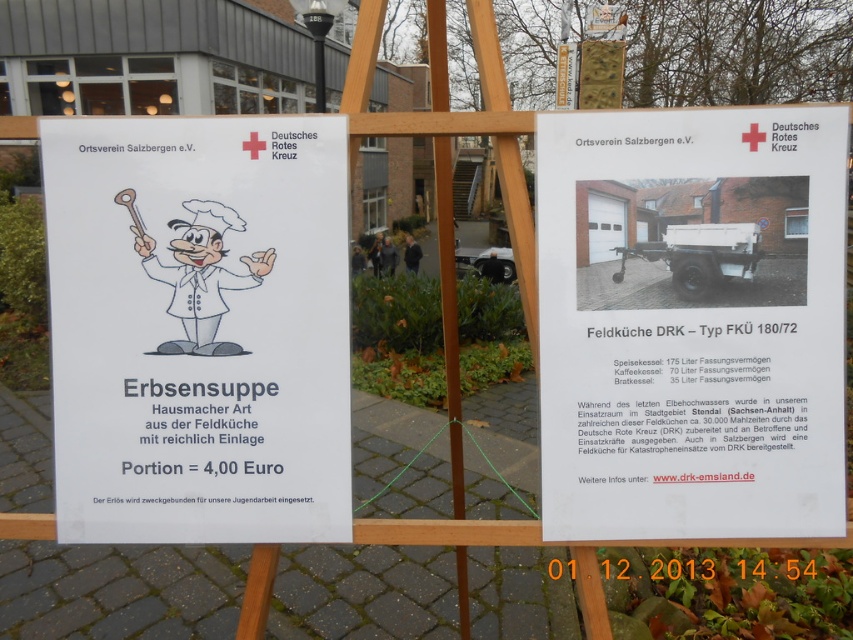
Question: Is white paper poster at center wider than white paper at center?

Choices:
 (A) yes
 (B) no

Answer: (A)

Question: Which object is closer to the camera taking this photo?

Choices:
 (A) white paper poster at center
 (B) white paper at center

Answer: (B)

Question: Considering the relative positions of white paper poster at center and white paper at center in the image provided, where is white paper poster at center located with respect to white paper at center?

Choices:
 (A) left
 (B) right

Answer: (A)

Question: Among these points, which one is nearest to the camera?

Choices:
 (A) (228, 120)
 (B) (822, 276)

Answer: (B)

Question: Considering the relative positions of white paper poster at center and white paper at center in the image provided, where is white paper poster at center located with respect to white paper at center?

Choices:
 (A) right
 (B) left

Answer: (B)

Question: Which point appears closest to the camera in this image?

Choices:
 (A) (62, 269)
 (B) (569, 304)

Answer: (B)